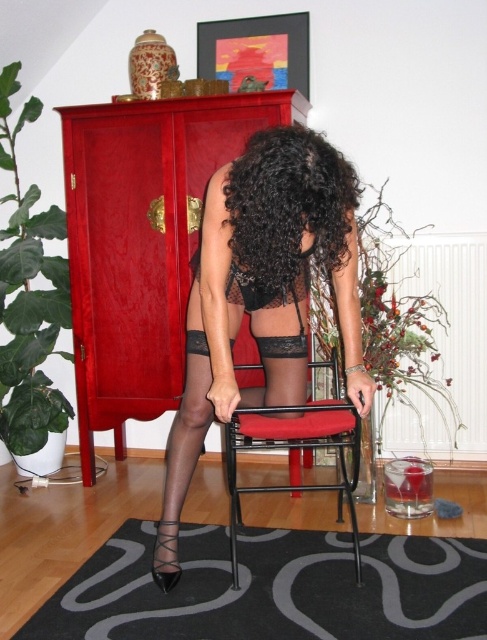
Question: Estimate the real-world distances between objects in this image. Which object is closer to the shiny lacquered cabinet at center?

Choices:
 (A) black metal chair at center
 (B) black curly hair at center

Answer: (A)

Question: Can you confirm if matte black lingerie at center is positioned above black metal chair at center?

Choices:
 (A) no
 (B) yes

Answer: (B)

Question: Is black curly hair at center positioned before black metal chair at center?

Choices:
 (A) yes
 (B) no

Answer: (A)

Question: Which point is farther to the camera?

Choices:
 (A) (325, 413)
 (B) (319, 150)
 (C) (111, 116)

Answer: (C)

Question: Is matte black lingerie at center below black curly hair at center?

Choices:
 (A) yes
 (B) no

Answer: (A)

Question: Which point is closer to the camera?

Choices:
 (A) (337, 180)
 (B) (331, 435)
 (C) (351, 195)

Answer: (A)